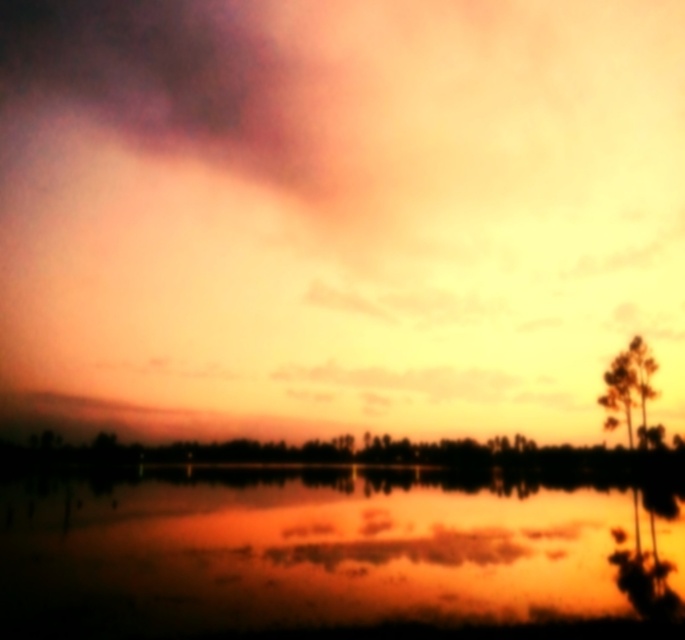
Which is behind, point (480, 602) or point (630, 374)?

The point (630, 374) is behind.

Which is above, reflective water at center or green matte tree at right?

Positioned higher is green matte tree at right.

The width and height of the screenshot is (685, 640). In order to click on reflective water at center in this screenshot , I will do `click(303, 548)`.

You are a GUI agent. You are given a task and a screenshot of the screen. Output one action in this format:
    pyautogui.click(x=<x>, y=<y>)
    Task: Click on the reflective water at center
    
    Given the screenshot: What is the action you would take?
    pyautogui.click(x=303, y=548)

Can you confirm if matte orange cloud at upper center is positioned below reflective water at center?

No.

Where is `matte orange cloud at upper center`? matte orange cloud at upper center is located at coordinates (338, 212).

Is matte orange cloud at upper center smaller than green matte tree at right?

No.

Can you confirm if matte orange cloud at upper center is positioned below green matte tree at right?

No, matte orange cloud at upper center is not below green matte tree at right.

Identify the location of matte orange cloud at upper center. (338, 212).